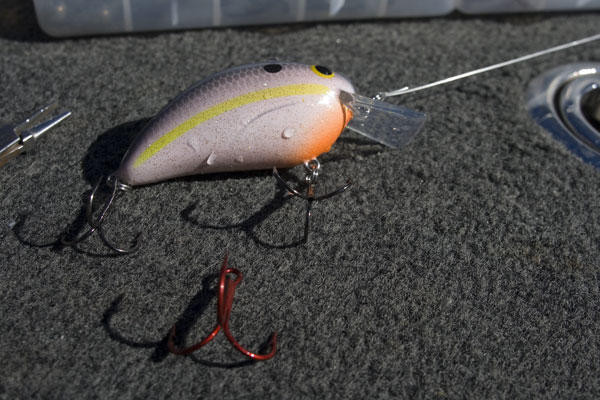
The width and height of the screenshot is (600, 400). I want to click on leftmost hook, so 98,223.